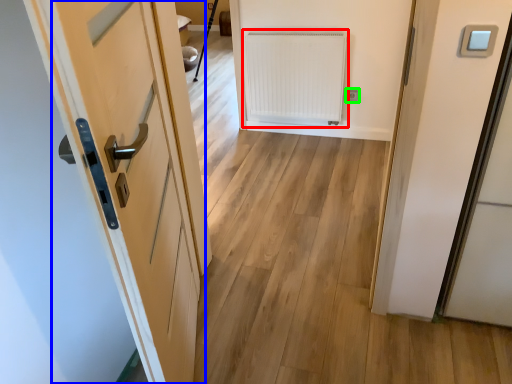
Question: Considering the real-world distances, which object is farthest from radiator (highlighted by a red box)? door (highlighted by a blue box) or electric outlet (highlighted by a green box)?

Choices:
 (A) door
 (B) electric outlet

Answer: (A)